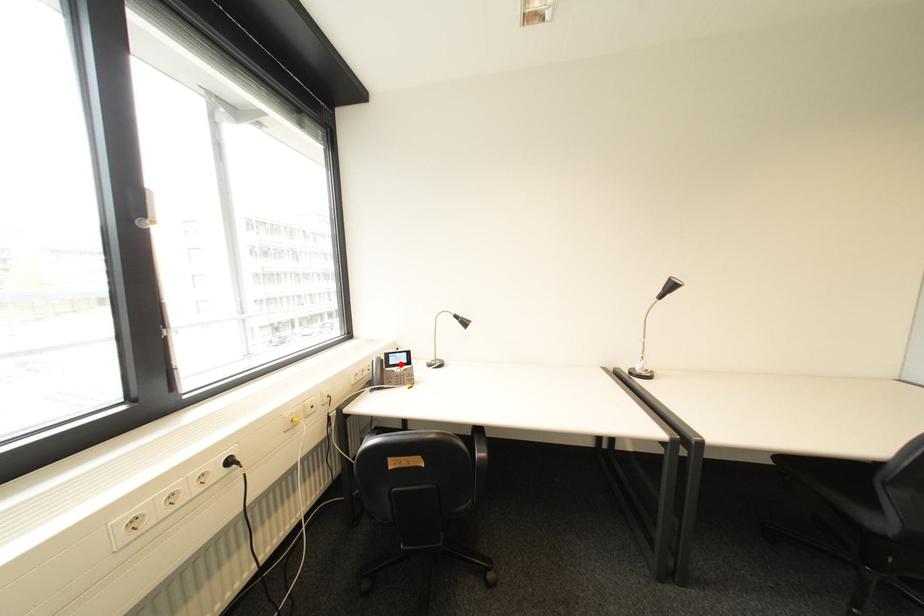
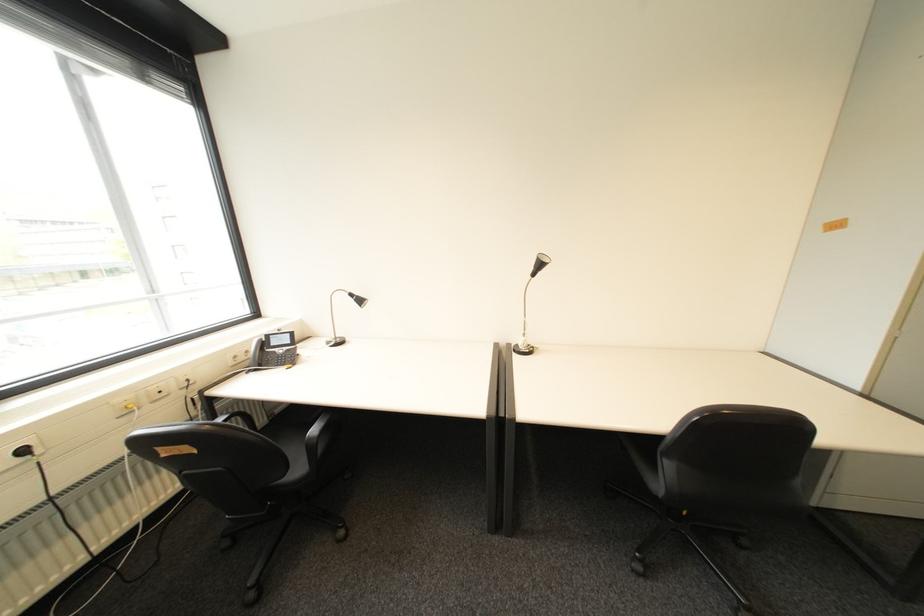
In the second image, find the point that corresponds to the highlighted location in the first image.

(283, 345)